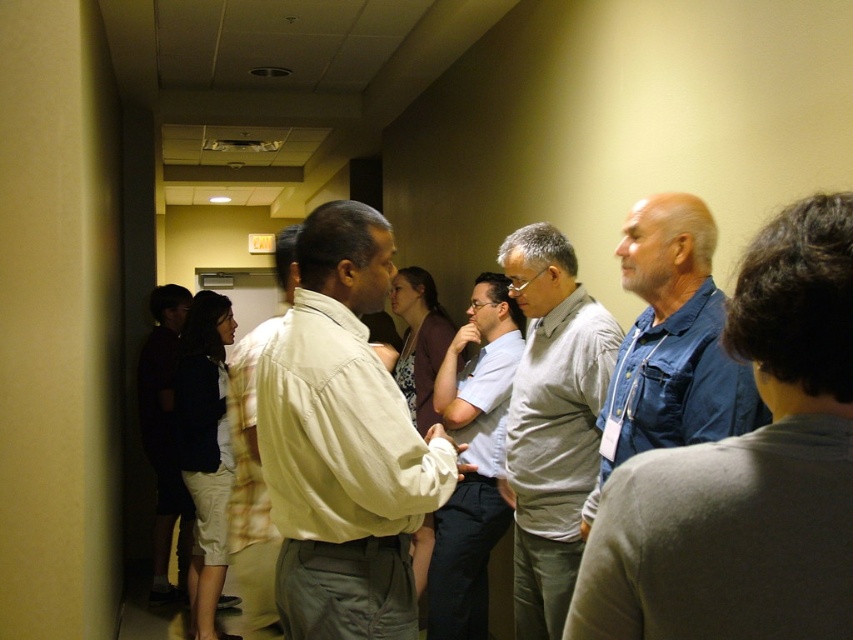
You are standing at the entrance of the hallway and want to approach the group. There are two points marked in the scene. Which point should you move towards if you want to get closer to the group without obstructing the conversation? Please choose between point (569, 481) and point (711, 316).

You should move towards point (711, 316) because point (569, 481) is behind it, so approaching the closer point would allow you to get nearer to the group without blocking the conversation.

You are organizing a photo shoot and need to ensure that the denim jacket at right and the dark blue shirt at left are visible in the final shot. Based on their positions, which clothing item is covering part of the other?

The denim jacket at right is positioned over the dark blue shirt at left, meaning the denim jacket is covering part of the dark blue shirt.

In the scene shown: You are a photographer at the event and want to take a photo of both the light blue shirt at center and the light beige shirt at center. Which one should you adjust your camera angle to focus on first if you want to capture both in the frame without moving the subjects?

You should focus on the light beige shirt at center first since it is positioned to the left of the light blue shirt at center, allowing both to be captured in the frame by adjusting the angle towards the left.